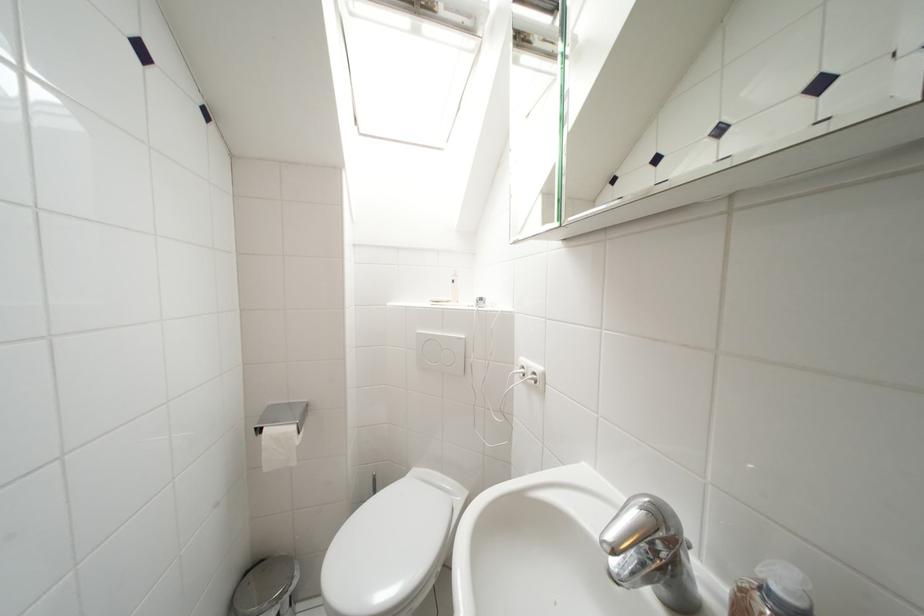
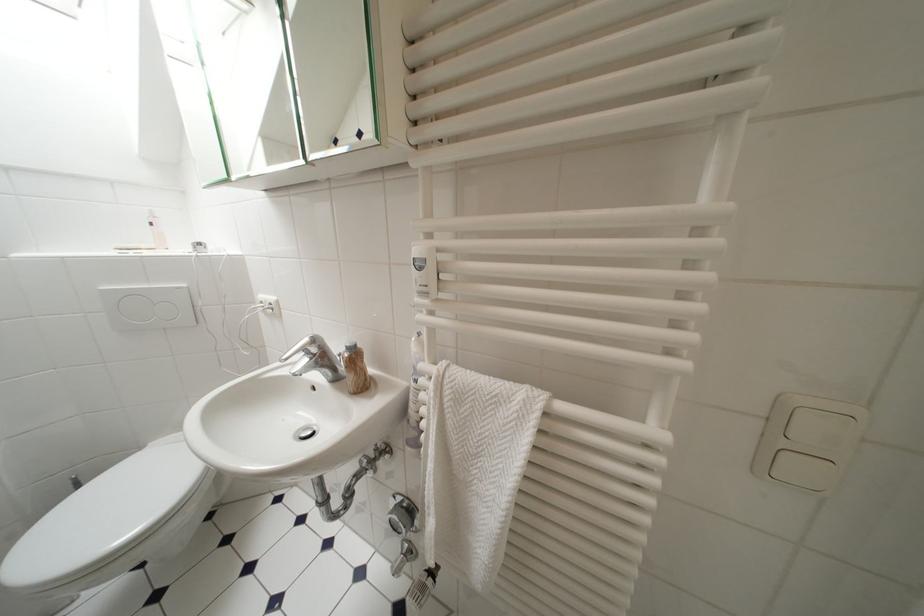
The point at (415,476) is marked in the first image. Where is the corresponding point in the second image?

(148, 451)